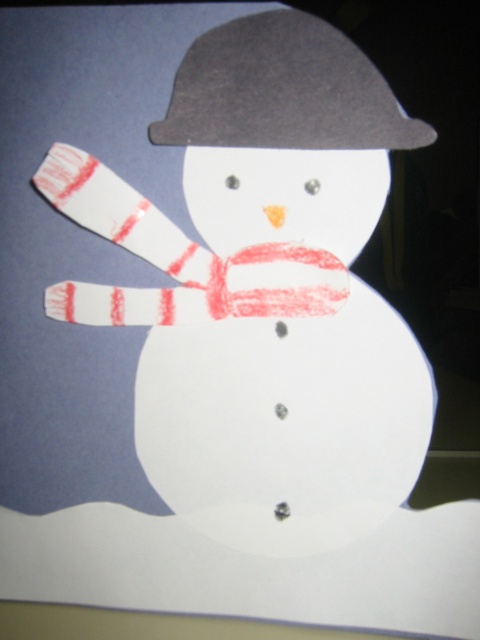
You are an artist trying to paint the snowman. You want to paint the dark gray felt hat at upper center first. Should you paint the white paper snowman at center before or after painting the hat?

You should paint the white paper snowman at center after painting the dark gray felt hat at upper center because the white paper snowman at center is closer to the viewer, so painting it first would cover parts of the hat that are behind it.

You are an artist looking at the image of a snowman. You need to place a decorative ribbon exactly between the white paper snowman at center and the dark gray felt hat at upper center. Where should you place the ribbon relative to the hat?

The white paper snowman at center is positioned on the left side of dark gray felt hat at upper center, so the ribbon should be placed to the left of the hat.

You are an artist planning to draw a new snowman on a canvas. You have the white paper snowman at center and the dark gray felt hat at upper center. Which object should you draw first to ensure proper placement?

The white paper snowman at center should be drawn first because it is much taller than the dark gray felt hat at upper center, so positioning it first ensures the hat can be placed correctly on top.